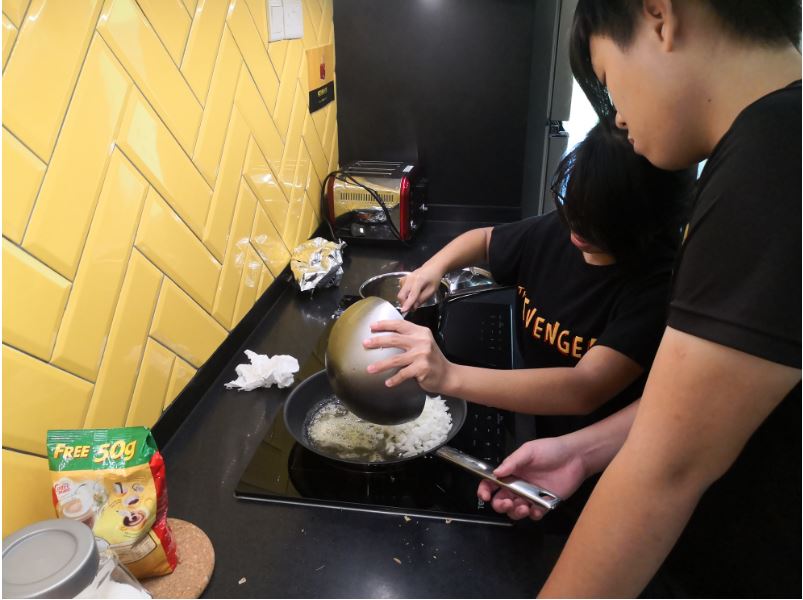
Where is `toaster`? Image resolution: width=803 pixels, height=600 pixels. toaster is located at coordinates (381, 197).